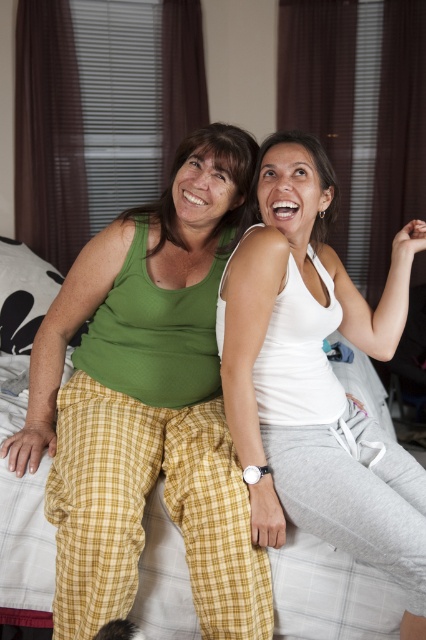
Does green cotton tank top at center have a lesser width compared to white matte tank top at center?

No.

Can you confirm if green cotton tank top at center is taller than white matte tank top at center?

Correct, green cotton tank top at center is much taller as white matte tank top at center.

Describe the element at coordinates (147, 404) in the screenshot. I see `green cotton tank top at center` at that location.

Where is `green cotton tank top at center`? The width and height of the screenshot is (426, 640). green cotton tank top at center is located at coordinates (147, 404).